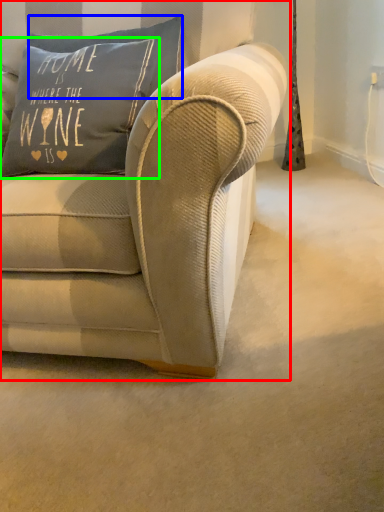
Question: Which object is the farthest from studio couch (highlighted by a red box)? Choose among these: pillow (highlighted by a blue box) or pillow (highlighted by a green box).

Choices:
 (A) pillow
 (B) pillow

Answer: (A)